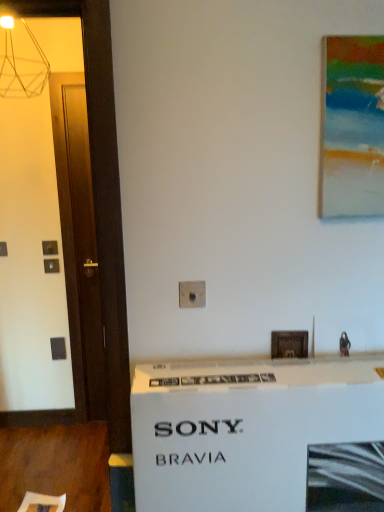
Question: Is wooden picture frame at center, the second picture frame from the front, positioned before acrylic painting at upper right, the 1th picture frame from the top?

Choices:
 (A) yes
 (B) no

Answer: (B)

Question: From a real-world perspective, is wooden picture frame at center, which is counted as the second picture frame, starting from the top, on acrylic painting at upper right, the 1th picture frame from the top?

Choices:
 (A) yes
 (B) no

Answer: (B)

Question: Is wooden picture frame at center, which is the first picture frame in bottom-to-top order, positioned with its back to acrylic painting at upper right, the 1th picture frame positioned from the right?

Choices:
 (A) no
 (B) yes

Answer: (A)

Question: Is wooden picture frame at center, which is the first picture frame in bottom-to-top order, to the left of acrylic painting at upper right, the 1th picture frame from the top, from the viewer's perspective?

Choices:
 (A) yes
 (B) no

Answer: (A)

Question: Are wooden picture frame at center, which is counted as the second picture frame, starting from the top, and acrylic painting at upper right, positioned as the first picture frame in front-to-back order, located far from each other?

Choices:
 (A) yes
 (B) no

Answer: (B)

Question: From a real-world perspective, is acrylic painting at upper right, positioned as the first picture frame in front-to-back order, above or below white cardboard box at center?

Choices:
 (A) above
 (B) below

Answer: (A)

Question: Is acrylic painting at upper right, the second picture frame in the left-to-right sequence, taller or shorter than white cardboard box at center?

Choices:
 (A) tall
 (B) short

Answer: (B)

Question: Choose the correct answer: Is acrylic painting at upper right, the 1th picture frame from the top, inside white cardboard box at center or outside it?

Choices:
 (A) inside
 (B) outside

Answer: (B)

Question: Considering the positions of acrylic painting at upper right, the second picture frame in the left-to-right sequence, and white cardboard box at center in the image, is acrylic painting at upper right, the second picture frame in the left-to-right sequence, wider or thinner than white cardboard box at center?

Choices:
 (A) wide
 (B) thin

Answer: (B)

Question: Would you say acrylic painting at upper right, which appears as the 2th picture frame when viewed from the back, is inside or outside wooden picture frame at center, which is counted as the second picture frame, starting from the top?

Choices:
 (A) outside
 (B) inside

Answer: (A)

Question: Considering the positions of acrylic painting at upper right, the 1th picture frame from the top, and wooden picture frame at center, placed as the first picture frame when sorted from left to right, in the image, is acrylic painting at upper right, the 1th picture frame from the top, bigger or smaller than wooden picture frame at center, placed as the first picture frame when sorted from left to right,?

Choices:
 (A) small
 (B) big

Answer: (B)

Question: From their relative heights in the image, would you say acrylic painting at upper right, the second picture frame in the left-to-right sequence, is taller or shorter than wooden picture frame at center, placed as the first picture frame when sorted from left to right?

Choices:
 (A) short
 (B) tall

Answer: (B)

Question: Considering the positions of point (337, 58) and point (306, 351), is point (337, 58) closer or farther from the camera than point (306, 351)?

Choices:
 (A) closer
 (B) farther

Answer: (A)

Question: From the image's perspective, is wooden picture frame at center, the second picture frame viewed from the right, above or below white cardboard box at center?

Choices:
 (A) above
 (B) below

Answer: (A)

Question: Considering their positions, is wooden picture frame at center, marked as the 1th picture frame in a back-to-front arrangement, located in front of or behind white cardboard box at center?

Choices:
 (A) behind
 (B) front

Answer: (A)